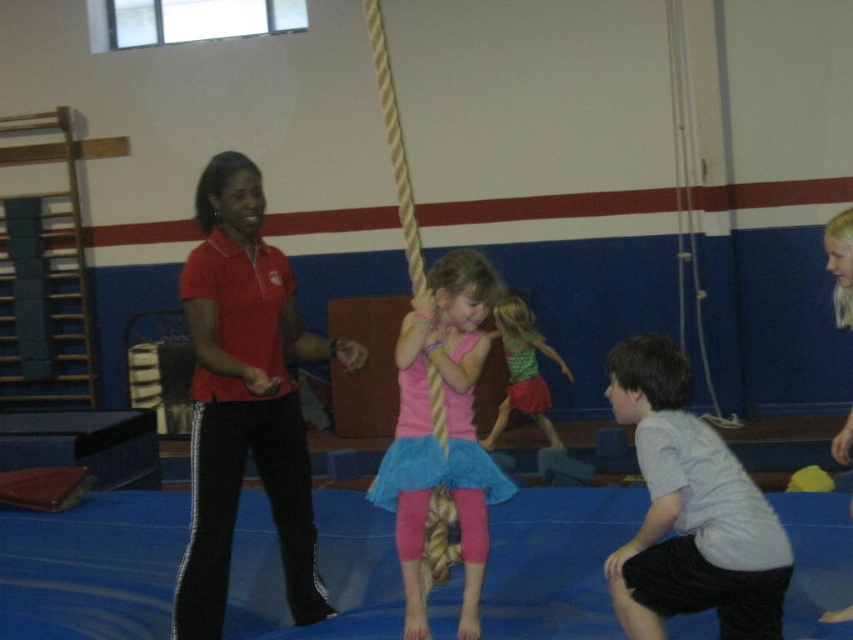
Which is below, gray cotton shirt at lower right or pink satin skirt at center?

gray cotton shirt at lower right is lower down.

Does point (752, 506) come farther from viewer compared to point (416, 298)?

No, (752, 506) is in front of (416, 298).

This screenshot has width=853, height=640. Identify the location of gray cotton shirt at lower right. (689, 509).

Is gray cotton shirt at lower right smaller than green textured dress at center?

Indeed, gray cotton shirt at lower right has a smaller size compared to green textured dress at center.

Who is positioned more to the right, gray cotton shirt at lower right or green textured dress at center?

Positioned to the right is gray cotton shirt at lower right.

Identify the location of gray cotton shirt at lower right. (689, 509).

Who is taller, pink satin skirt at center or green textured dress at center?

pink satin skirt at center is taller.

Which is above, pink satin skirt at center or green textured dress at center?

green textured dress at center

This screenshot has height=640, width=853. Find the location of `pink satin skirt at center`. pink satin skirt at center is located at coordinates (447, 432).

Find the location of a particular element. This screenshot has height=640, width=853. pink satin skirt at center is located at coordinates (447, 432).